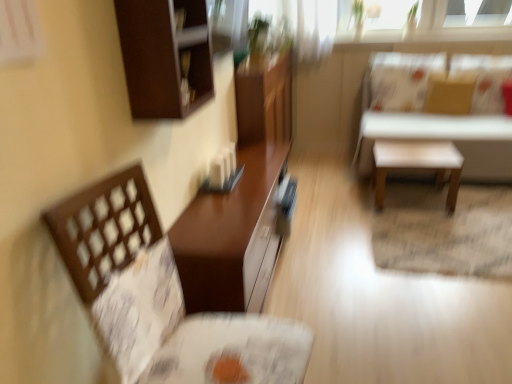
You are a GUI agent. You are given a task and a screenshot of the screen. Output one action in this format:
    pyautogui.click(x=<x>, y=<y>)
    Task: Click on the vacant area that is in front of white matte stool at center
    This screenshot has width=512, height=384.
    Given the screenshot: What is the action you would take?
    pyautogui.click(x=434, y=224)